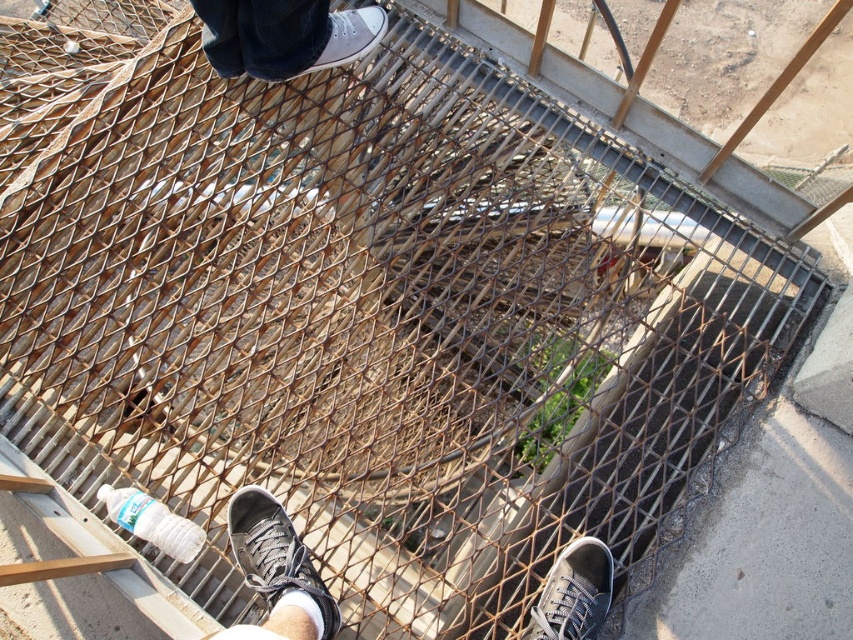
You are a safety inspector evaluating the placement of footwear on the staircase. You notice the matte gray sneaker at lower right and the matte gray canvas shoe at upper center. Which shoe has a higher height?

The matte gray canvas shoe at upper center is taller than the matte gray sneaker at lower right.

You are a safety inspector checking the staircase for proper footwear placement. You notice two matte gray sneakers on the steps. Which sneaker is closer to you, the matte gray sneaker at lower center or the matte gray sneaker at lower right?

The matte gray sneaker at lower center is closer to you because it is further to the viewer than the matte gray sneaker at lower right.